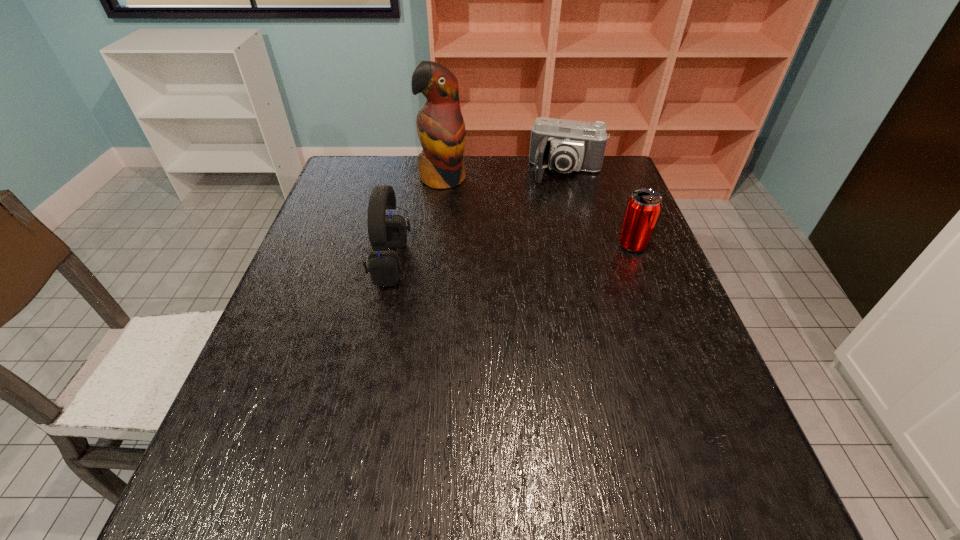
Find the location of a particular element. This screenshot has height=540, width=960. vacant space situated 0.210m on the face of the tallest object is located at coordinates (468, 235).

Locate an element on the screen. Image resolution: width=960 pixels, height=540 pixels. vacant area located on the face of the tallest object is located at coordinates (462, 220).

Locate an element on the screen. The image size is (960, 540). free region located 0.400m on the face of the tallest object is located at coordinates (492, 282).

Locate an element on the screen. The image size is (960, 540). camera that is at the far edge is located at coordinates (563, 145).

The height and width of the screenshot is (540, 960). Identify the location of parrot situated at the far edge. (440, 125).

Find the location of `soda can at the right edge`. soda can at the right edge is located at coordinates (644, 206).

Identify the location of camera that is at the right edge. The height and width of the screenshot is (540, 960). (563, 145).

Find the location of a particular element. The image size is (960, 540). object present at the far right corner is located at coordinates (563, 145).

I want to click on vacant space at the far edge, so click(479, 185).

At what (x,y) coordinates should I click in order to perform the action: click on vacant space at the near edge of the desktop. Please return your answer as a coordinate pair (x, y). Looking at the image, I should click on [582, 415].